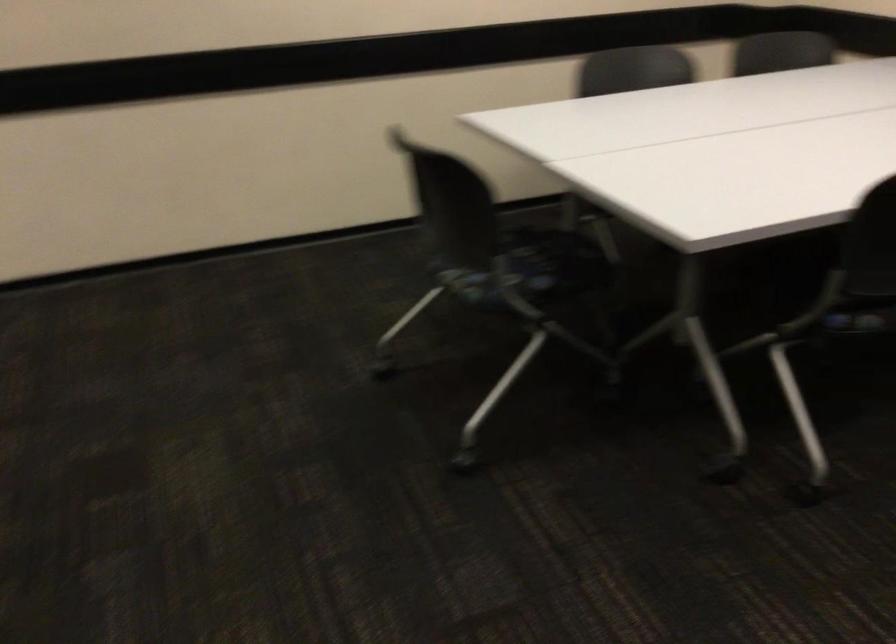
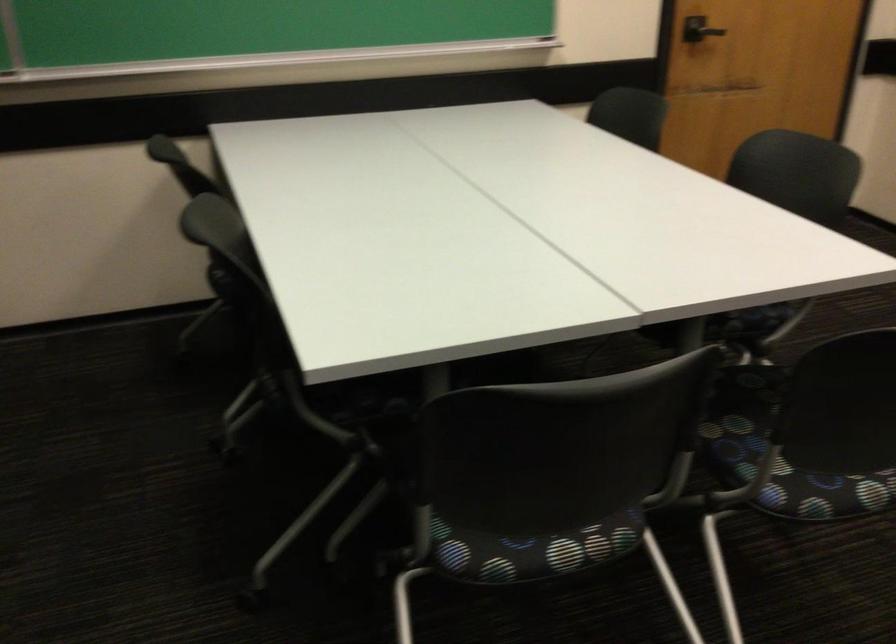
The first image is from the beginning of the video and the second image is from the end. How did the camera likely rotate when shooting the video?

The rotation direction of the camera is left-down.